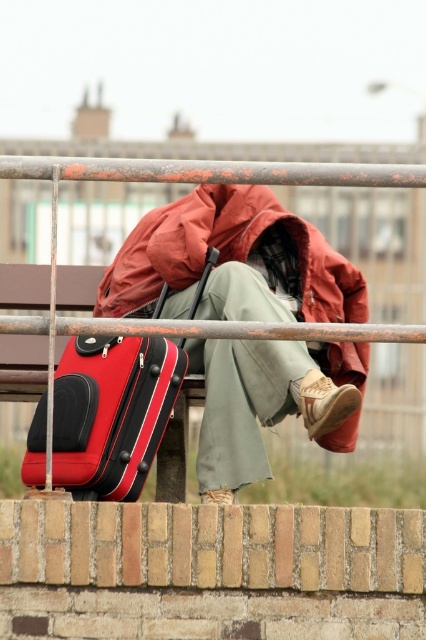
Question: Does matte red jacket at center have a larger size compared to rubberized red suitcase at left?

Choices:
 (A) yes
 (B) no

Answer: (B)

Question: Is matte red jacket at center bigger than rubberized red suitcase at left?

Choices:
 (A) no
 (B) yes

Answer: (A)

Question: Which point is farther from the camera taking this photo?

Choices:
 (A) (238, 413)
 (B) (77, 481)

Answer: (A)

Question: Which of the following is the farthest from the observer?

Choices:
 (A) matte red jacket at center
 (B) rubberized red suitcase at left

Answer: (A)

Question: Can you confirm if matte red jacket at center is positioned below rubberized red suitcase at left?

Choices:
 (A) no
 (B) yes

Answer: (A)